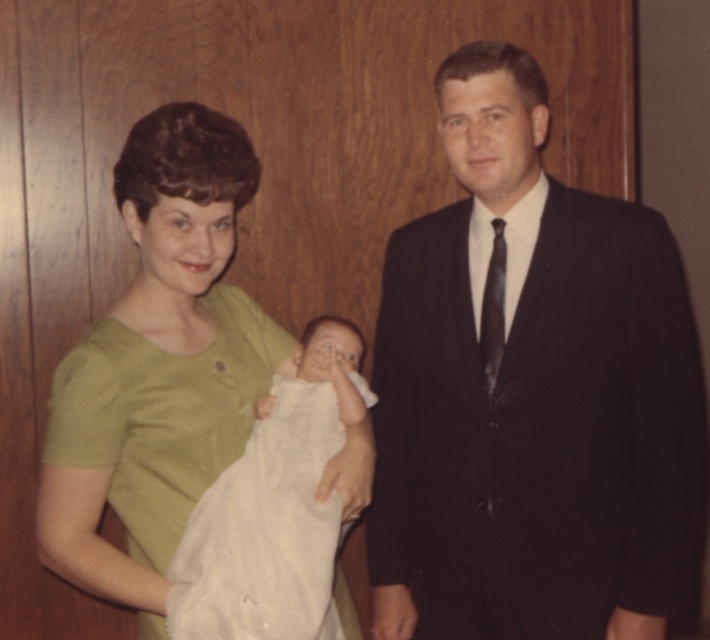
Question: Can you confirm if dark suit at center is smaller than green matte dress at center?

Choices:
 (A) yes
 (B) no

Answer: (B)

Question: Does green matte dress at center have a greater width compared to white soft cloth at center?

Choices:
 (A) yes
 (B) no

Answer: (A)

Question: Does dark suit at center have a larger size compared to green matte dress at center?

Choices:
 (A) yes
 (B) no

Answer: (A)

Question: Which object is closer to the camera taking this photo?

Choices:
 (A) white soft cloth at center
 (B) green matte dress at center

Answer: (A)

Question: Which point is closer to the camera taking this photo?

Choices:
 (A) (97, 545)
 (B) (567, 616)
 (C) (271, 432)

Answer: (A)

Question: Which object is farther from the camera taking this photo?

Choices:
 (A) dark suit at center
 (B) green matte dress at center
 (C) white soft cloth at center

Answer: (A)